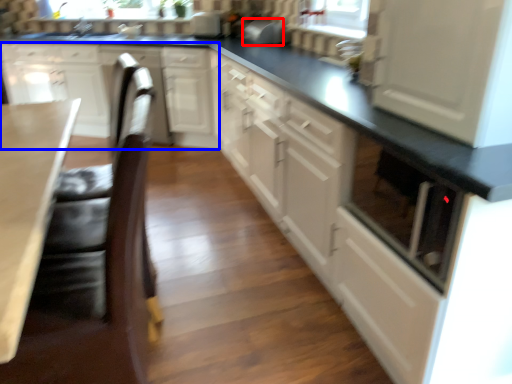
Question: Which of the following is the farthest to the observer, appliance (highlighted by a red box) or cabinetry (highlighted by a blue box)?

Choices:
 (A) appliance
 (B) cabinetry

Answer: (A)